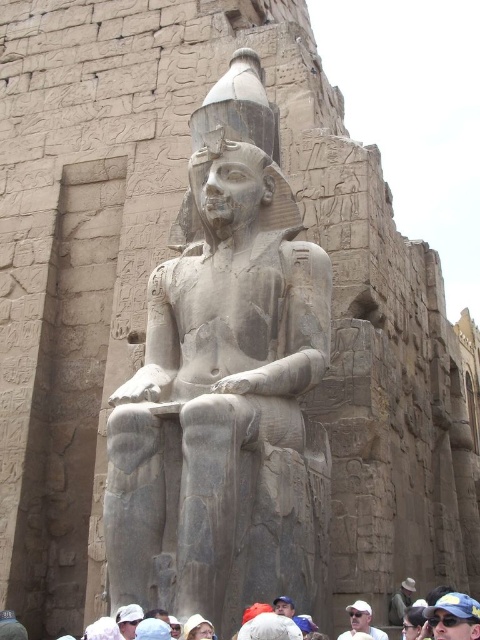
Question: Does white matte sunglasses at lower center appear under white matte cap at center?

Choices:
 (A) yes
 (B) no

Answer: (A)

Question: Which point is closer to the camera?

Choices:
 (A) white matte hat at center
 (B) white matte cap at center

Answer: (B)

Question: Considering the relative positions of white matte sunglasses at lower center and dark hair at lower center in the image provided, where is white matte sunglasses at lower center located with respect to dark hair at lower center?

Choices:
 (A) left
 (B) right

Answer: (B)

Question: Can you confirm if gray stone statue at center is thinner than white fabric cap at lower center?

Choices:
 (A) yes
 (B) no

Answer: (B)

Question: Which point is closer to the camera?

Choices:
 (A) (259, 125)
 (B) (367, 630)

Answer: (B)

Question: Which object is closer to the camera taking this photo?

Choices:
 (A) white fabric cap at lower center
 (B) white cotton hat at lower center
 (C) white matte cap at center

Answer: (B)